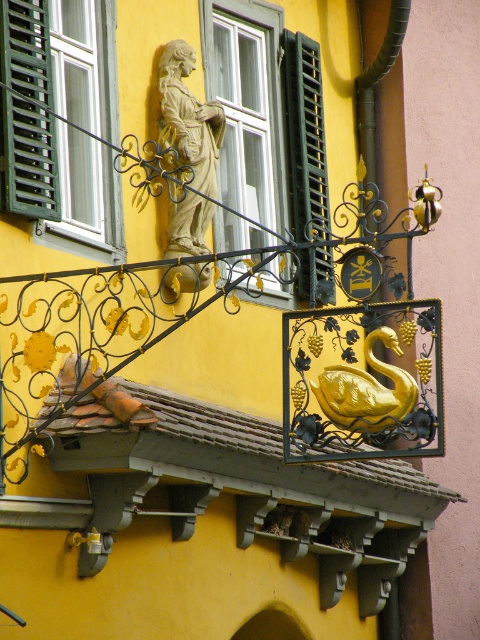
You are standing in front of the building and want to locate the green matte shutter at left. Where should you look relative to the statue of the woman?

The green matte shutter at left is located to the left of the statue of the woman, at coordinates point (27, 157).

You are standing in front of a building and see the black matte shutter at upper center and the gold metallic swan at center. Which object is positioned more to the left?

The black matte shutter at upper center is positioned more to the left than the gold metallic swan at center.